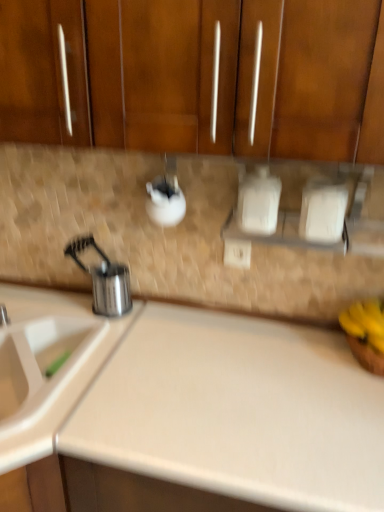
Question: Is white plastic sink at lower left turned away from beige laminate counter top at center?

Choices:
 (A) yes
 (B) no

Answer: (B)

Question: From a real-world perspective, is white plastic sink at lower left positioned over beige laminate counter top at center based on gravity?

Choices:
 (A) no
 (B) yes

Answer: (A)

Question: Is white plastic sink at lower left far from beige laminate counter top at center?

Choices:
 (A) yes
 (B) no

Answer: (B)

Question: Does white plastic sink at lower left have a greater height compared to beige laminate counter top at center?

Choices:
 (A) no
 (B) yes

Answer: (A)

Question: Considering the relative sizes of white plastic sink at lower left and beige laminate counter top at center in the image provided, is white plastic sink at lower left bigger than beige laminate counter top at center?

Choices:
 (A) yes
 (B) no

Answer: (A)

Question: From the image's perspective, is stainless steel utensil holder at left positioned above or below white plastic electric outlet at center?

Choices:
 (A) above
 (B) below

Answer: (B)

Question: In terms of width, does stainless steel utensil holder at left look wider or thinner when compared to white plastic electric outlet at center?

Choices:
 (A) wide
 (B) thin

Answer: (A)

Question: Is stainless steel utensil holder at left in front of or behind white plastic electric outlet at center in the image?

Choices:
 (A) front
 (B) behind

Answer: (A)

Question: Considering the positions of stainless steel utensil holder at left and white plastic electric outlet at center in the image, is stainless steel utensil holder at left bigger or smaller than white plastic electric outlet at center?

Choices:
 (A) small
 (B) big

Answer: (B)

Question: Is yellow matte bananas at right in front of or behind stainless steel utensil holder at left in the image?

Choices:
 (A) front
 (B) behind

Answer: (A)

Question: Would you say yellow matte bananas at right is inside or outside stainless steel utensil holder at left?

Choices:
 (A) inside
 (B) outside

Answer: (B)

Question: In terms of size, does yellow matte bananas at right appear bigger or smaller than stainless steel utensil holder at left?

Choices:
 (A) big
 (B) small

Answer: (B)

Question: Is point (374, 315) positioned closer to the camera than point (107, 309)?

Choices:
 (A) closer
 (B) farther

Answer: (A)

Question: From a real-world perspective, is white plastic electric outlet at center physically located above or below stainless steel utensil holder at left?

Choices:
 (A) above
 (B) below

Answer: (A)

Question: Relative to stainless steel utensil holder at left, is white plastic electric outlet at center in front or behind?

Choices:
 (A) behind
 (B) front

Answer: (A)